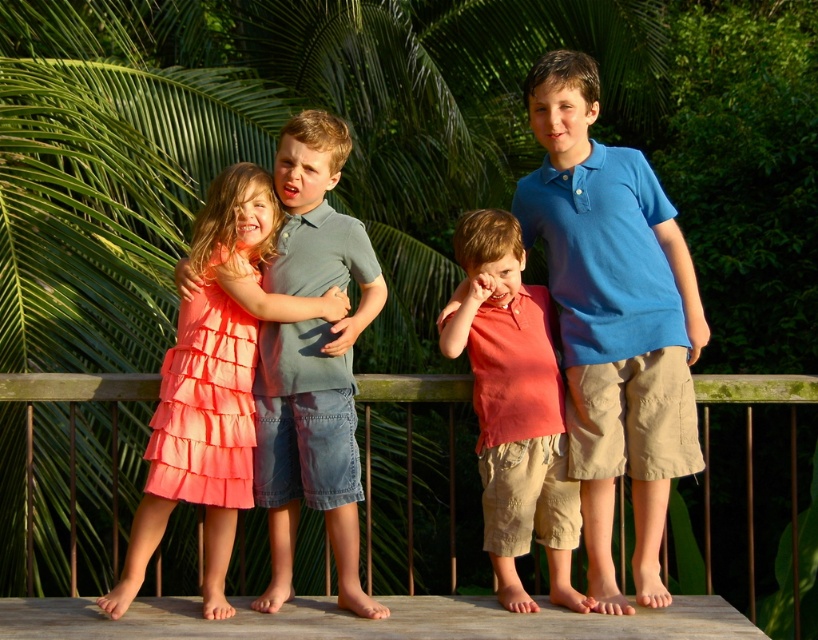
Question: Does matte coral dress at left have a larger size compared to matte coral shirt at center?

Choices:
 (A) yes
 (B) no

Answer: (A)

Question: Estimate the real-world distances between objects in this image. Which object is closer to the wooden at center?

Choices:
 (A) matte coral shirt at center
 (B) matte coral dress at left

Answer: (A)

Question: Among these objects, which one is farthest from the camera?

Choices:
 (A) matte coral shirt at center
 (B) matte coral dress at left
 (C) blue cotton shirt at center

Answer: (C)

Question: Among these points, which one is nearest to the camera?

Choices:
 (A) (540, 305)
 (B) (228, 477)
 (C) (428, 611)
 (D) (97, 392)

Answer: (B)

Question: Does matte coral shirt at center have a lesser width compared to wooden at center?

Choices:
 (A) no
 (B) yes

Answer: (B)

Question: Is matte coral dress at left closer to the viewer compared to matte coral shirt at center?

Choices:
 (A) no
 (B) yes

Answer: (B)